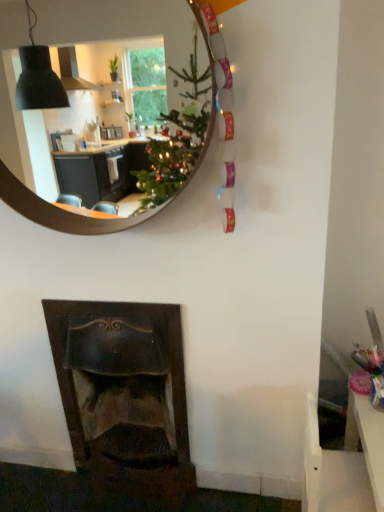
Question: Is dark wood fireplace at lower left completely or partially inside white plastic table at lower right?

Choices:
 (A) no
 (B) yes

Answer: (A)

Question: From a real-world perspective, is white plastic table at lower right physically above dark wood fireplace at lower left?

Choices:
 (A) yes
 (B) no

Answer: (B)

Question: Considering the relative sizes of white plastic table at lower right and dark wood fireplace at lower left in the image provided, is white plastic table at lower right smaller than dark wood fireplace at lower left?

Choices:
 (A) yes
 (B) no

Answer: (A)

Question: Is white plastic table at lower right far from dark wood fireplace at lower left?

Choices:
 (A) no
 (B) yes

Answer: (A)

Question: Is white plastic table at lower right to the left of dark wood fireplace at lower left from the viewer's perspective?

Choices:
 (A) yes
 (B) no

Answer: (B)

Question: Is point (67, 373) positioned closer to the camera than point (147, 10)?

Choices:
 (A) farther
 (B) closer

Answer: (B)

Question: Based on their sizes in the image, would you say dark wood fireplace at lower left is bigger or smaller than wooden mirror at upper center?

Choices:
 (A) big
 (B) small

Answer: (A)

Question: Is dark wood fireplace at lower left situated inside wooden mirror at upper center or outside?

Choices:
 (A) inside
 (B) outside

Answer: (B)

Question: Considering the positions of dark wood fireplace at lower left and wooden mirror at upper center in the image, is dark wood fireplace at lower left wider or thinner than wooden mirror at upper center?

Choices:
 (A) wide
 (B) thin

Answer: (A)

Question: Based on their positions, is white plastic table at lower right located to the left or right of dark wood fireplace at lower left?

Choices:
 (A) right
 (B) left

Answer: (A)

Question: Is point (370, 415) closer or farther from the camera than point (66, 301)?

Choices:
 (A) farther
 (B) closer

Answer: (B)

Question: Relative to dark wood fireplace at lower left, is white plastic table at lower right in front or behind?

Choices:
 (A) behind
 (B) front

Answer: (B)

Question: From a real-world perspective, is white plastic table at lower right above or below dark wood fireplace at lower left?

Choices:
 (A) below
 (B) above

Answer: (A)

Question: Which is correct: wooden mirror at upper center is inside white plastic table at lower right, or outside of it?

Choices:
 (A) inside
 (B) outside

Answer: (B)

Question: Is wooden mirror at upper center in front of or behind white plastic table at lower right in the image?

Choices:
 (A) front
 (B) behind

Answer: (A)